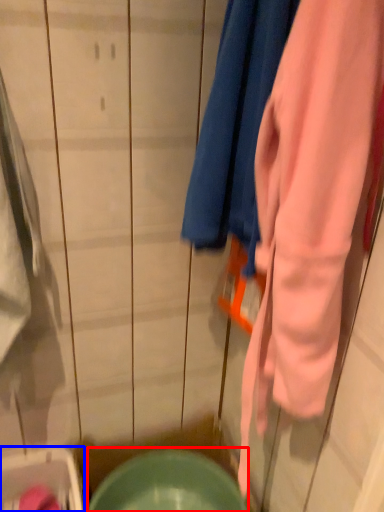
Question: Which point is further to the camera, mixing bowl (highlighted by a red box) or washer (highlighted by a blue box)?

Choices:
 (A) mixing bowl
 (B) washer

Answer: (A)